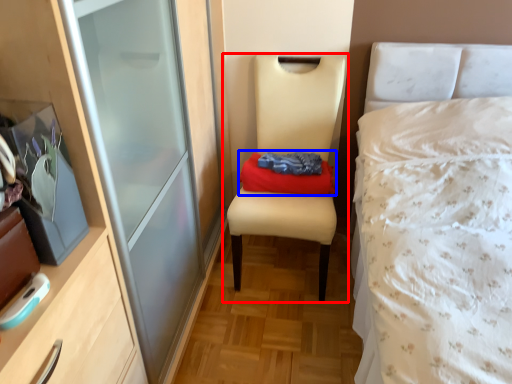
Question: Which object appears farthest to the camera in this image, chair (highlighted by a red box) or clothing (highlighted by a blue box)?

Choices:
 (A) chair
 (B) clothing

Answer: (B)